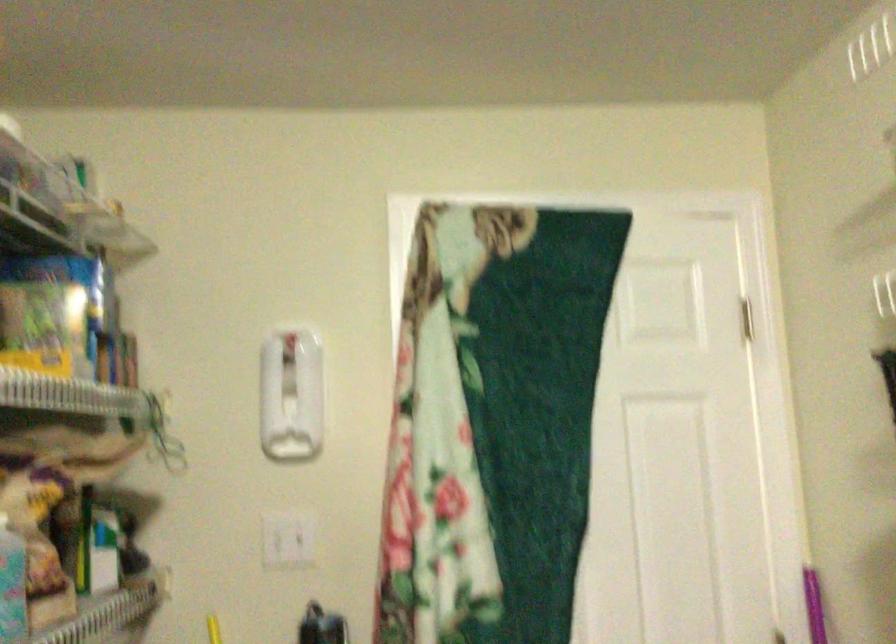
The image size is (896, 644). Describe the element at coordinates (290, 395) in the screenshot. I see `a dispenser lever` at that location.